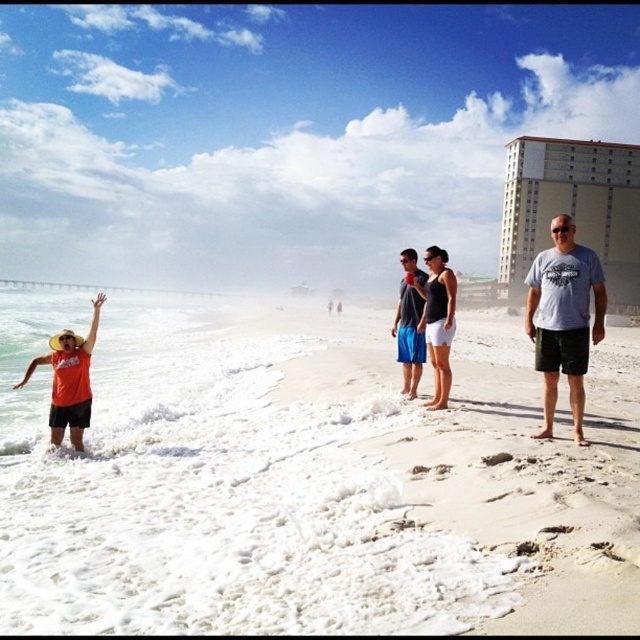
How far apart are white sandy beach at lower left and gray cotton t-shirt at center-right?

18.87 meters

Measure the distance between white sandy beach at lower left and camera.

white sandy beach at lower left is 11.62 feet away from camera.

Identify the location of white sandy beach at lower left. (308, 480).

Image resolution: width=640 pixels, height=640 pixels. Describe the element at coordinates (308, 480) in the screenshot. I see `white sandy beach at lower left` at that location.

Can you confirm if white sandy beach at lower left is thinner than white cotton shorts at center?

Incorrect, white sandy beach at lower left's width is not less than white cotton shorts at center's.

Find the location of a particular element. This screenshot has height=640, width=640. white sandy beach at lower left is located at coordinates (308, 480).

You are a GUI agent. You are given a task and a screenshot of the screen. Output one action in this format:
    pyautogui.click(x=<x>, y=<y>)
    Task: Click on the white sandy beach at lower left
    The width and height of the screenshot is (640, 640).
    Given the screenshot: What is the action you would take?
    pyautogui.click(x=308, y=480)

Does orange t-shirt at left appear over blue cotton shorts at center?

No.

Which is more to the right, orange t-shirt at left or blue cotton shorts at center?

blue cotton shorts at center is more to the right.

Is point (56, 352) positioned behind point (401, 346)?

No, it is not.

The image size is (640, 640). What are the coordinates of `orange t-shirt at left` in the screenshot? It's located at (68, 380).